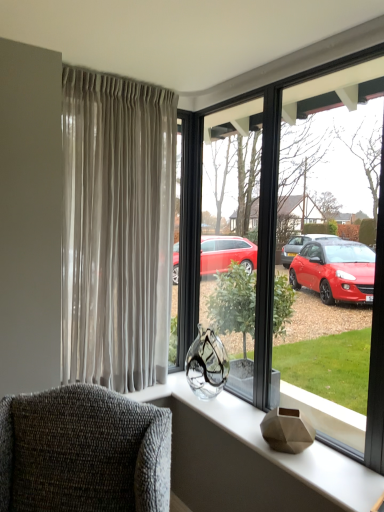
In order to click on free space above matte gray vase at center (from a real-world perspective) in this screenshot , I will do `click(254, 418)`.